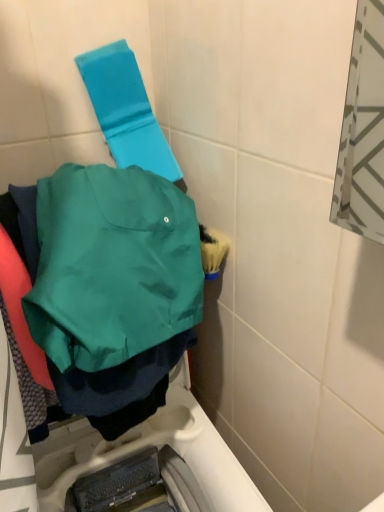
What do you see at coordinates (112, 266) in the screenshot?
I see `green fabric jacket at center` at bounding box center [112, 266].

Locate an element on the screen. The height and width of the screenshot is (512, 384). green fabric jacket at center is located at coordinates (112, 266).

What is the approximate width of green fabric jacket at center?

green fabric jacket at center is 22.80 centimeters in width.

Locate an element on the screen. The height and width of the screenshot is (512, 384). green fabric jacket at center is located at coordinates (112, 266).